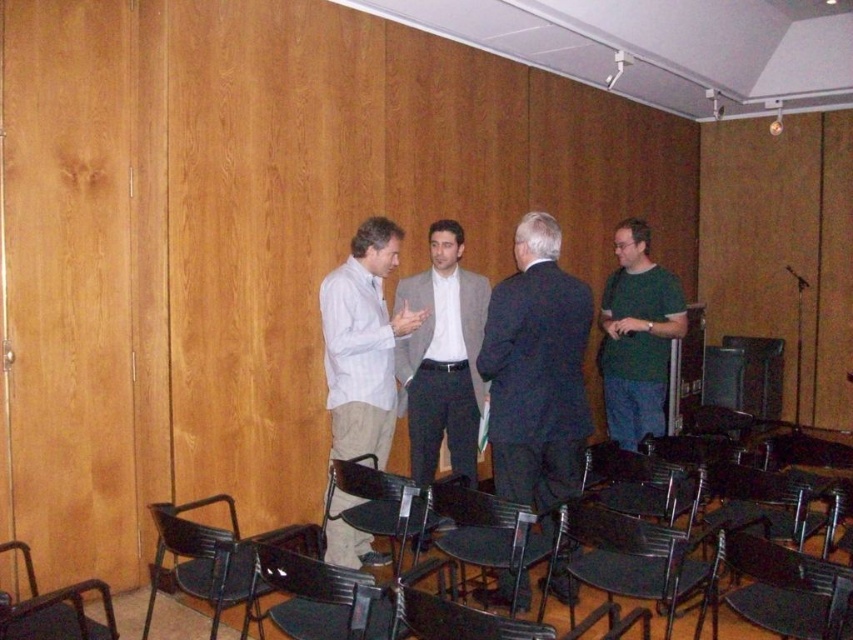
Question: Which of the following is the farthest from the observer?

Choices:
 (A) (410, 371)
 (B) (45, 593)
 (C) (808, 611)
 (D) (572, 380)

Answer: (A)

Question: Which of these objects is positioned farthest from the metallic black chair at lower center?

Choices:
 (A) black plastic chair at lower center
 (B) black plastic chair at center
 (C) dark blue suit at center
 (D) metallic black chair at lower left

Answer: (D)

Question: Among these points, which one is farthest from the camera?

Choices:
 (A) (399, 339)
 (B) (190, 561)
 (C) (730, 572)

Answer: (A)

Question: Can you confirm if dark blue suit at center is smaller than gray suit at center?

Choices:
 (A) yes
 (B) no

Answer: (B)

Question: Can you confirm if gray suit at center is positioned to the left of black plastic chair at center?

Choices:
 (A) no
 (B) yes

Answer: (B)

Question: Where is metallic black chair at lower left located in relation to black plastic chair at lower left in the image?

Choices:
 (A) right
 (B) left

Answer: (A)